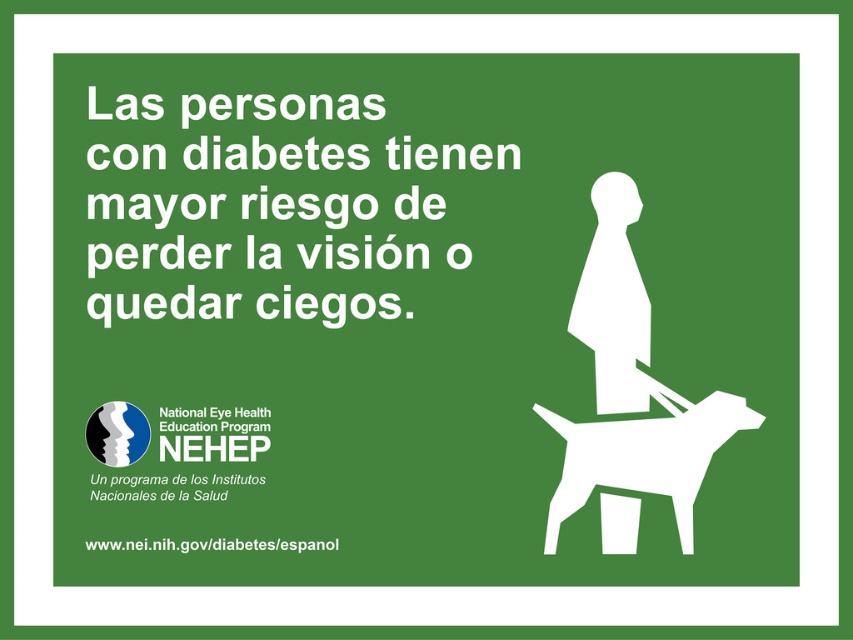
You are designing a poster and need to ensure that important elements are easily visible. The white matte dog at lower right and the white matte silhouette at center are both key elements. Considering their sizes, which element should be placed closer to the viewer to maintain visual hierarchy?

The white matte dog at lower right is larger than the white matte silhouette at center. To maintain visual hierarchy, the white matte dog at lower right should be placed closer to the viewer since larger elements typically draw more attention and are perceived as closer in visual composition.

You are designing a poster and need to ensure the white matte dog at lower right and the white matte silhouette at center are spaced appropriately. According to the design guidelines, objects must be at least 3 inches apart. Does the current spacing meet the requirement?

The white matte dog at lower right is 3.39 inches away from the white matte silhouette at center, which exceeds the minimum 3 inches requirement. Therefore, the spacing meets the guidelines.

You are designing a layout for a public health poster and need to ensure that the white matte dog at lower right and the white matte silhouette at center are positioned correctly according to the spatial relationship described. Based on the provided information, which object should appear closer to the viewer?

The white matte dog at lower right should appear closer to the viewer because it is described as being closer than the white matte silhouette at center.